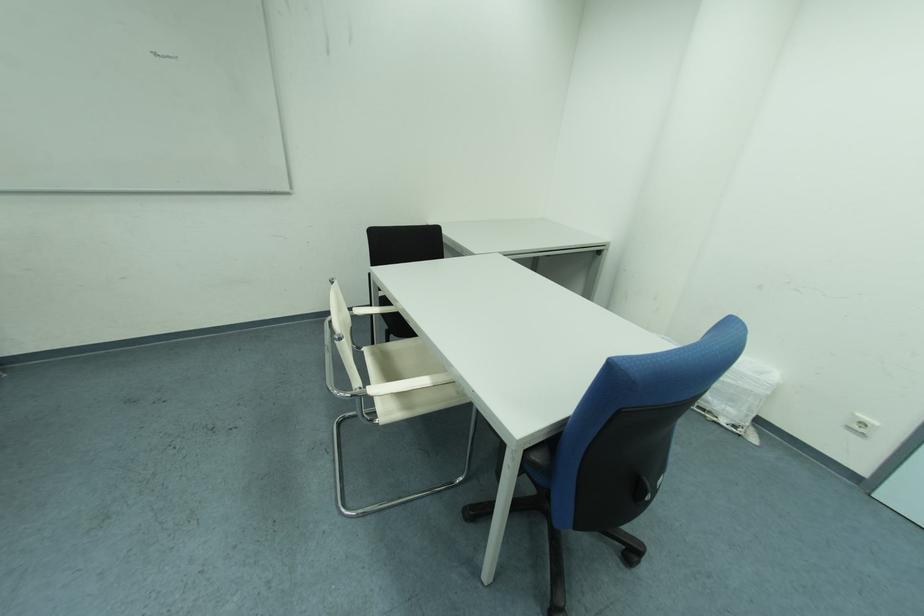
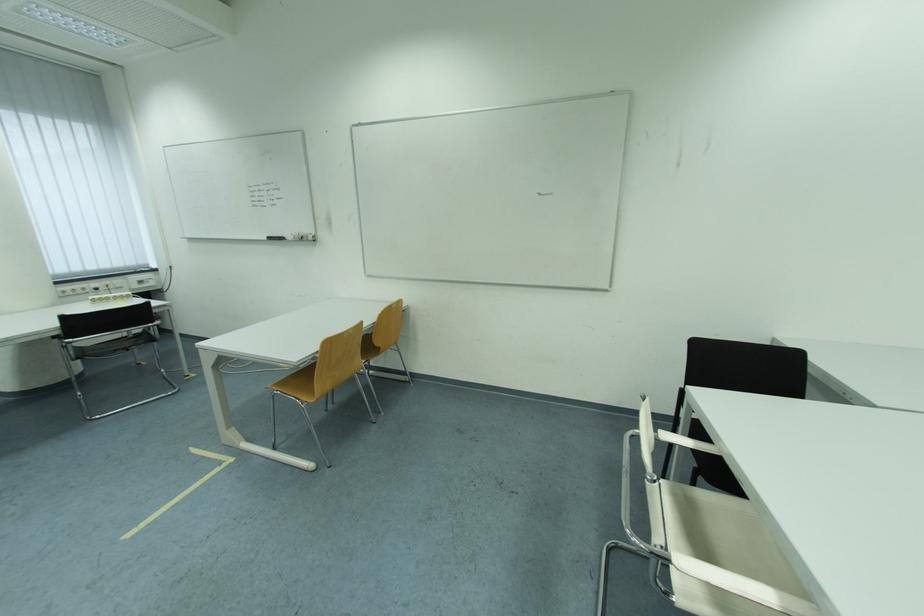
Question: The images are taken continuously from a first-person perspective. In which direction is your viewpoint rotating?

Choices:
 (A) Left
 (B) Right
 (C) Up
 (D) Down

Answer: (A)